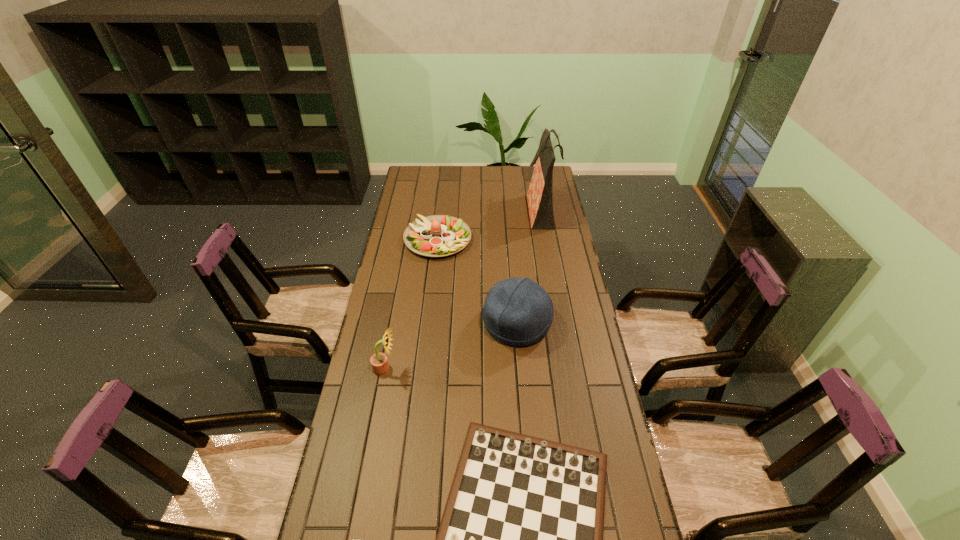
The image size is (960, 540). What are the coordinates of `the tallest object` in the screenshot? It's located at (540, 193).

What are the coordinates of `skullcap` in the screenshot? It's located at (518, 312).

The height and width of the screenshot is (540, 960). I want to click on the second nearest object, so click(x=379, y=362).

Where is `salad plate`? This screenshot has height=540, width=960. salad plate is located at coordinates (438, 235).

Find the location of a particular element. The image size is (960, 540). vacant space located 0.320m on the front side of the tallest object is located at coordinates (460, 210).

I want to click on vacant space situated on the front side of the tallest object, so click(471, 210).

The height and width of the screenshot is (540, 960). In order to click on vacant area located 0.160m on the front side of the tallest object in this screenshot , I will do `click(492, 210)`.

Locate an element on the screen. vacant space located 0.210m on the front of the skullcap is located at coordinates (524, 406).

I want to click on free space located on the face of the fourth farthest object, so click(459, 368).

Find the location of a particular element. This screenshot has height=540, width=960. vacant space located on the right of the salad plate is located at coordinates (538, 239).